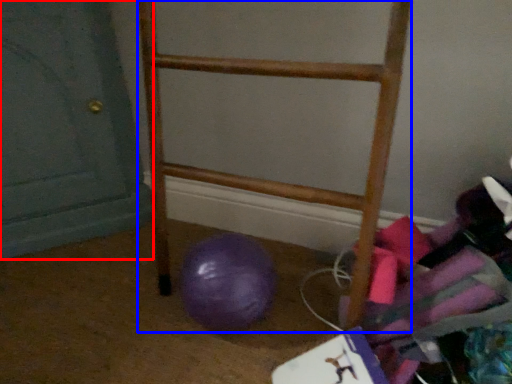
Question: Which point is further to the camera, door (highlighted by a red box) or furniture (highlighted by a blue box)?

Choices:
 (A) door
 (B) furniture

Answer: (A)